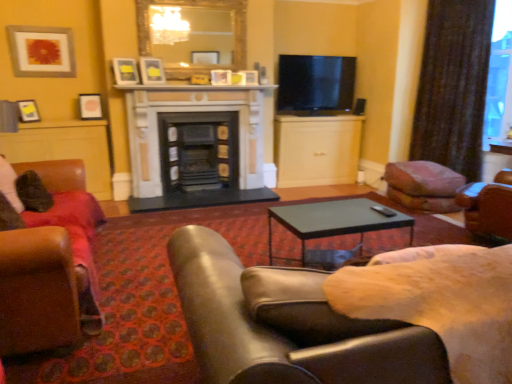
Question: Is marble fireplace at center, the second fireplace positioned from the left, inside the boundaries of matte black picture frame at upper center, positioned as the 1th picture frame in right-to-left order, or outside?

Choices:
 (A) outside
 (B) inside

Answer: (A)

Question: Is point (261, 105) closer or farther from the camera than point (140, 56)?

Choices:
 (A) farther
 (B) closer

Answer: (A)

Question: Which object is the farthest from the gold-framed mirror at upper center?

Choices:
 (A) dark gray textured curtain at right
 (B) black matte fireplace at center, which is the second fireplace in right-to-left order
 (C) matte black picture frame at upper center, acting as the 4th picture frame starting from the left
 (D) light wood cabinet at center
 (E) marble fireplace at center, which appears as the 1th fireplace when viewed from the right

Answer: (A)

Question: Estimate the real-world distances between objects in this image. Which object is farther from the matte black coffee table at center?

Choices:
 (A) matte black picture frame at upper center, acting as the 4th picture frame starting from the left
 (B) matte black picture frame at upper center, which is counted as the third picture frame, starting from the left
 (C) brown leather chair at left, the first chair from the left
 (D) marble fireplace at center, which appears as the 1th fireplace when viewed from the right
 (E) black glossy tv at upper right

Answer: (E)